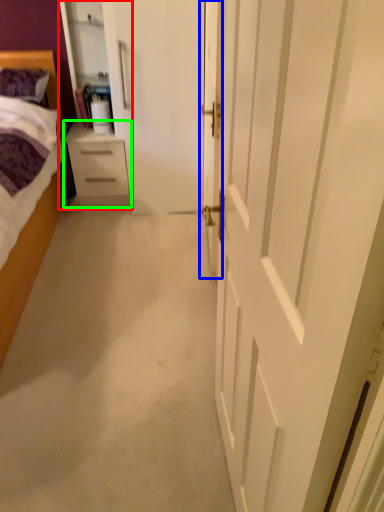
Question: Considering the real-world distances, which object is farthest from armoire (highlighted by a red box)? door (highlighted by a blue box) or chest of drawers (highlighted by a green box)?

Choices:
 (A) door
 (B) chest of drawers

Answer: (A)